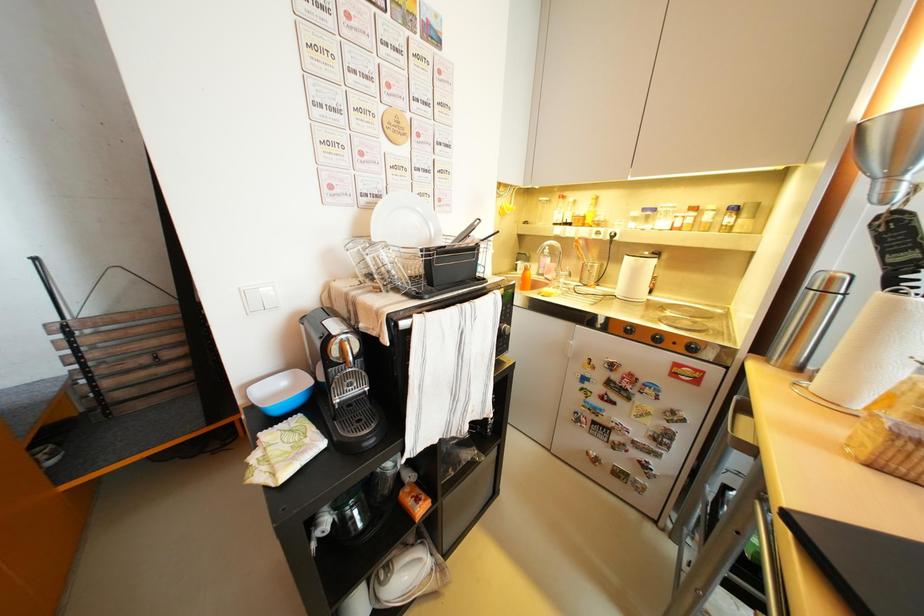
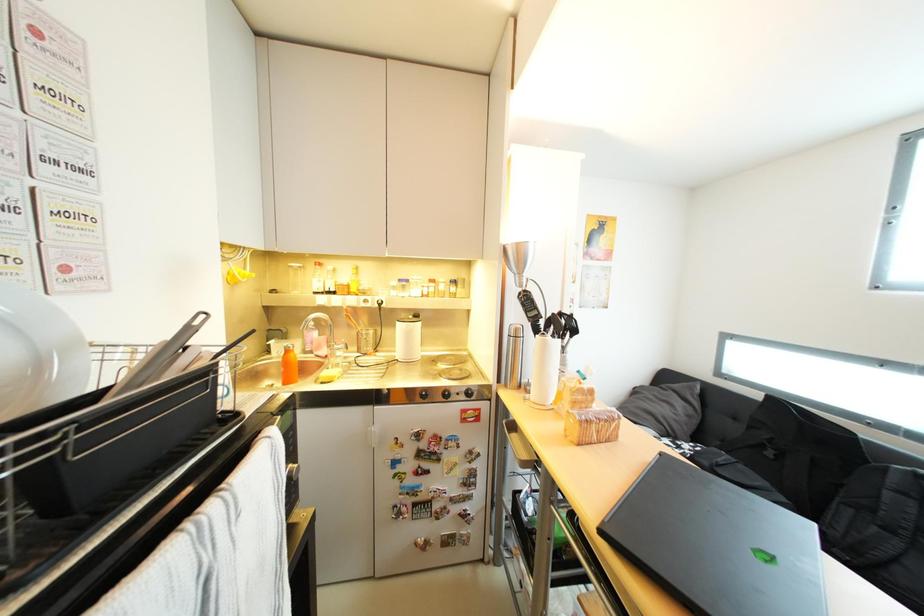
Question: The images are taken continuously from a first-person perspective. In which direction is your viewpoint rotating?

Choices:
 (A) Left
 (B) Right
 (C) Up
 (D) Down

Answer: (B)